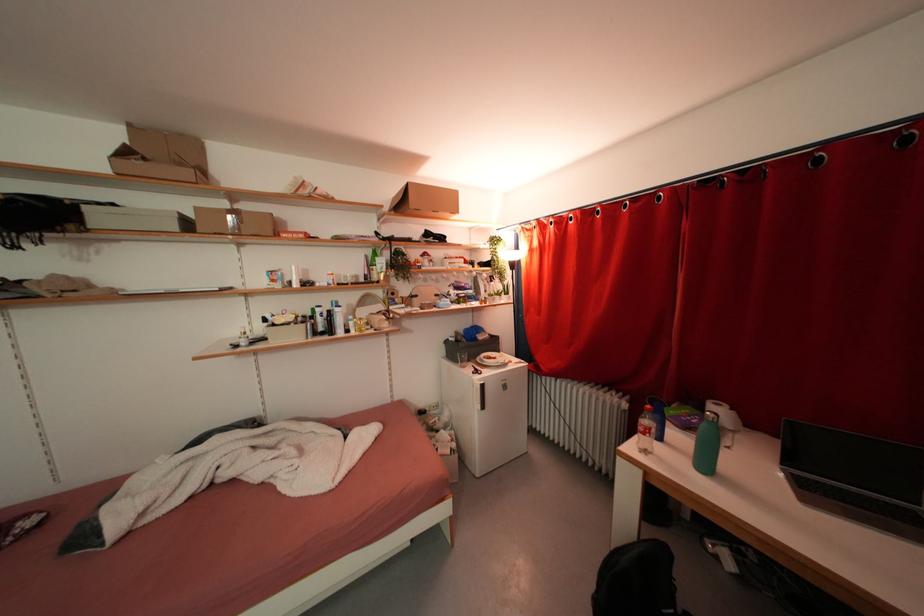
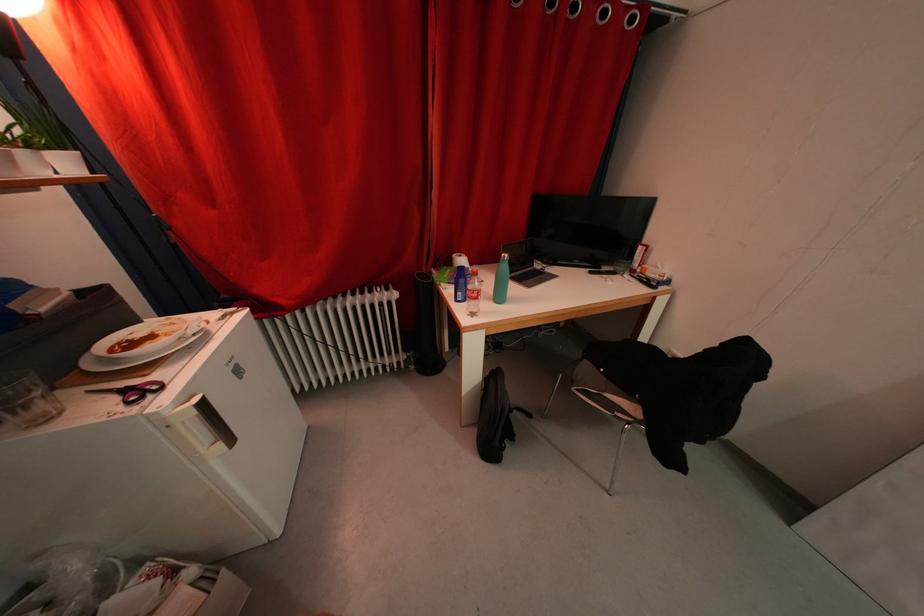
First-person continuous shooting, in which direction is the camera rotating?

The rotation direction of the camera is right-down.